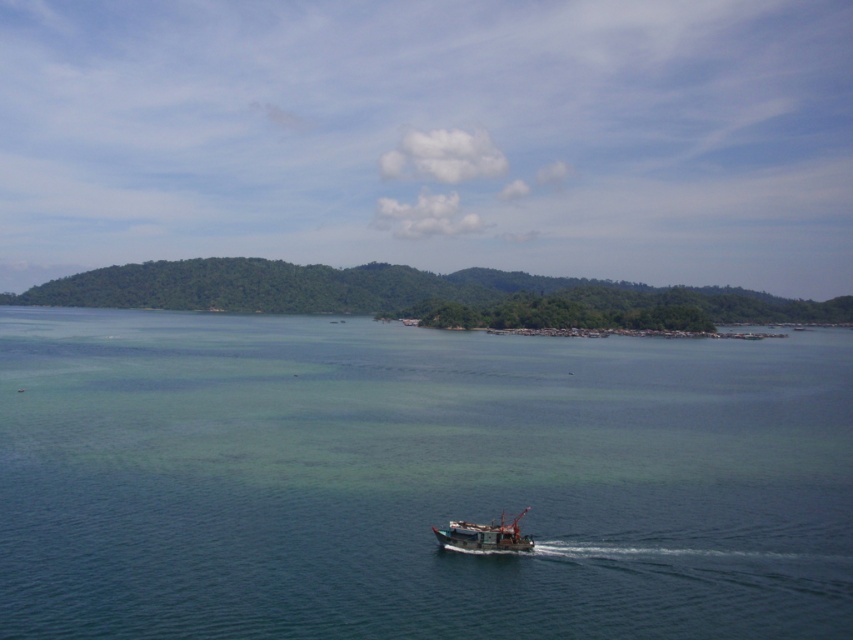
You are a photographer planning to capture the entire scene of the clear blue water at center and the wooden fishing boat at center in a single shot. Given that your camera has a fixed focal length, which object should you focus on first to ensure both are in frame?

The clear blue water at center is larger in size than the wooden fishing boat at center, so you should focus on the larger clear blue water at center first to ensure both fit within the frame.